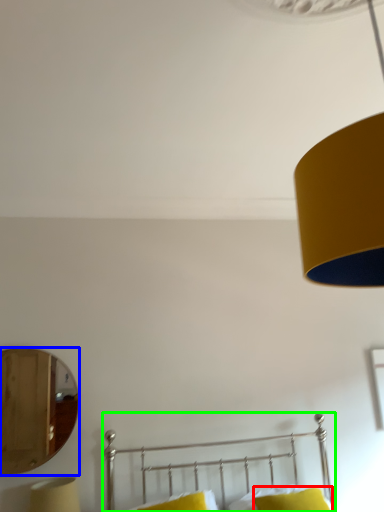
Question: Estimate the real-world distances between objects in this image. Which object is farther from pillow (highlighted by a red box), mirror (highlighted by a blue box) or bed (highlighted by a green box)?

Choices:
 (A) mirror
 (B) bed

Answer: (A)